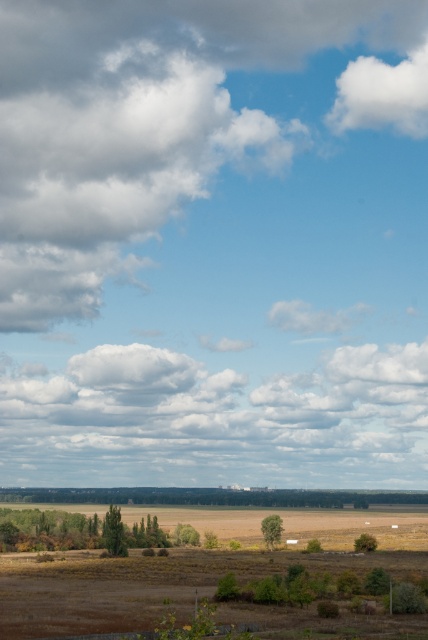
Question: Which of the following is the farthest from the observer?

Choices:
 (A) white fluffy cloud at upper right
 (B) brown dry grassland at lower center
 (C) brown grassland at lower center

Answer: (A)

Question: Does brown dry grassland at lower center appear over brown grassland at lower center?

Choices:
 (A) yes
 (B) no

Answer: (A)

Question: Which of the following is the farthest from the observer?

Choices:
 (A) coord(353,88)
 (B) coord(240,493)

Answer: (A)

Question: Does brown grassland at lower center appear on the left side of white fluffy cloud at upper right?

Choices:
 (A) yes
 (B) no

Answer: (A)

Question: Which object appears farthest from the camera in this image?

Choices:
 (A) brown grassland at lower center
 (B) brown dry grassland at lower center
 (C) white fluffy cloud at upper right

Answer: (C)

Question: Is brown grassland at lower center wider than white fluffy cloud at upper right?

Choices:
 (A) yes
 (B) no

Answer: (A)